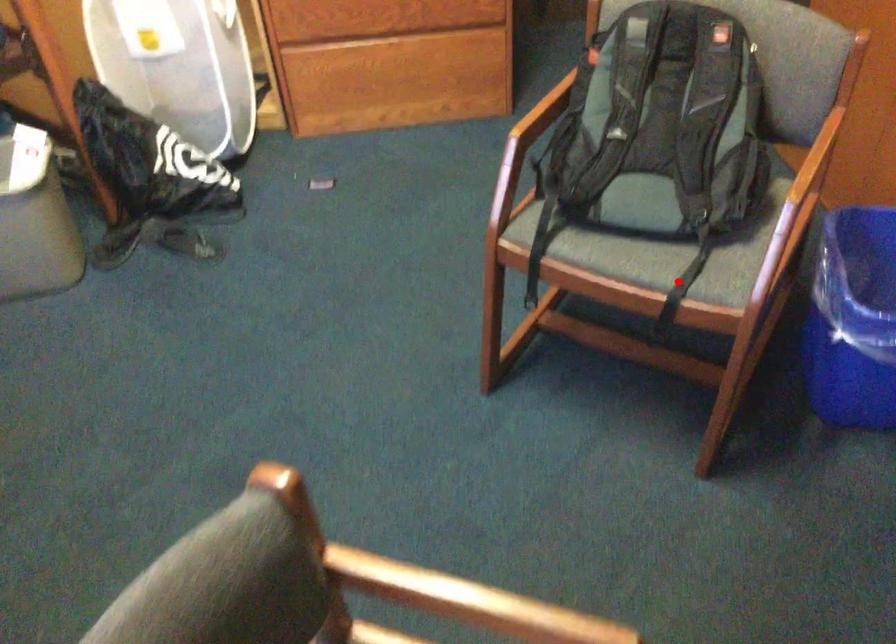
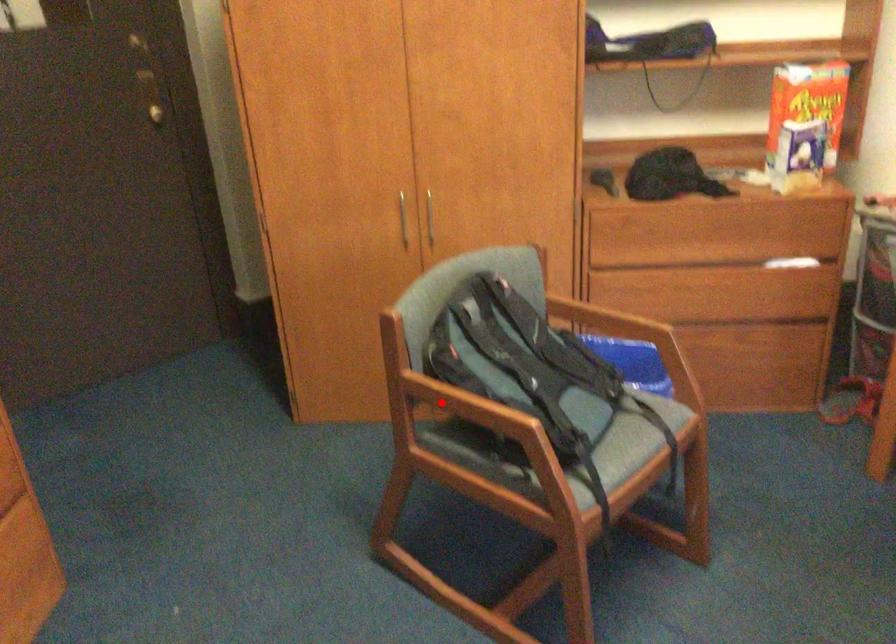
I am providing you with two images of the same scene from different viewpoints. A red point is marked on the first image and another point is marked on the second image. Is the red point in image1 aligned with the point shown in image2?

No